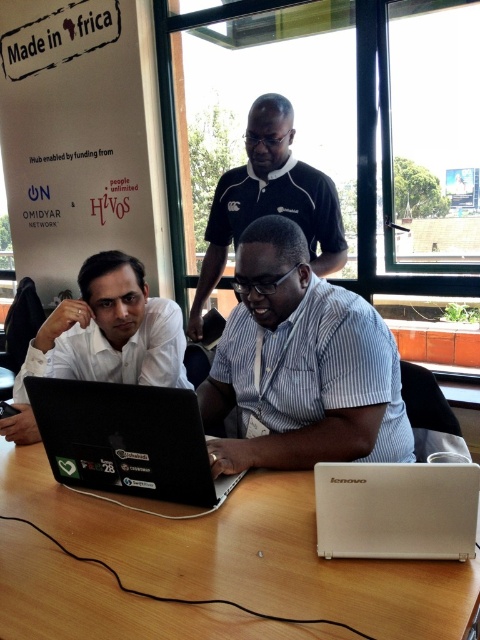
Question: Can you confirm if wooden table at center is thinner than white matte shirt at left?

Choices:
 (A) no
 (B) yes

Answer: (A)

Question: Does wooden table at center appear over black polo shirt at center?

Choices:
 (A) no
 (B) yes

Answer: (A)

Question: Considering the real-world distances, which object is closest to the wooden table at center?

Choices:
 (A) white striped shirt at center
 (B) black matte laptop at center

Answer: (B)

Question: Which point appears closest to the camera in this image?

Choices:
 (A) (376, 467)
 (B) (168, 458)
 (C) (40, 477)

Answer: (A)

Question: Which object appears farthest from the camera in this image?

Choices:
 (A) black polo shirt at center
 (B) black matte laptop at center
 (C) beige matte laptop at center

Answer: (A)

Question: Does wooden table at center appear on the left side of white matte shirt at left?

Choices:
 (A) yes
 (B) no

Answer: (B)